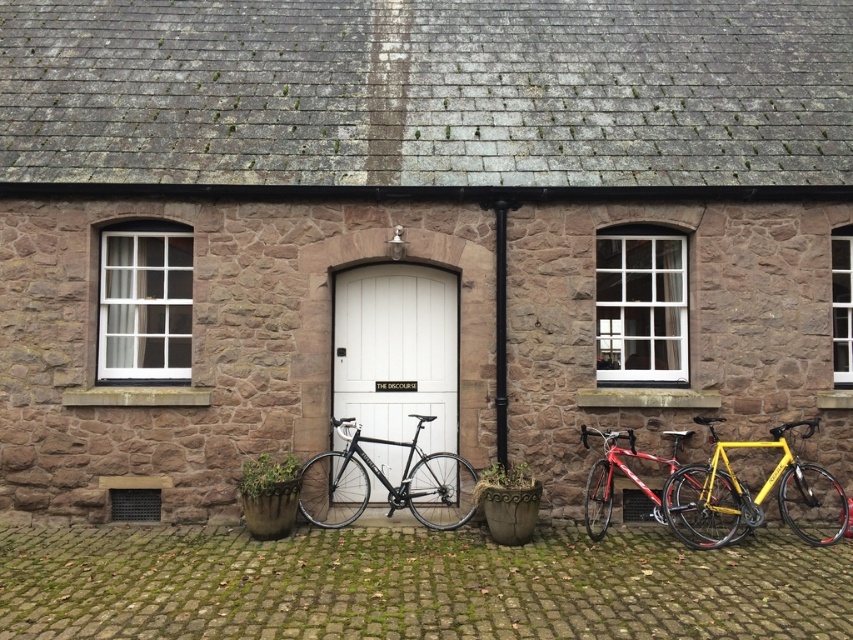
You are a visitor at the stone building and need to park your bicycles. The yellow matte bicycle at right and the shiny red bicycle at center are already parked. Which bicycle is taller?

The yellow matte bicycle at right is much taller than the shiny red bicycle at center.

You are a delivery person trying to deliver a package to the building. The shiny red bicycle at center is blocking the entrance. Can you pass through the white matte door at center without moving the bicycle?

The white matte door at center has a lesser width compared to shiny red bicycle at center, so the bicycle is wider than the door. Therefore, you cannot pass through the white matte door at center without moving the bicycle.

You are standing in front of the quaint stone building and want to enter through the white matte door at center. There is a 25 feet wide truck parked in front of the door. Can you walk around the truck to reach the door?

The distance between you and the white matte door at center is 30.41 feet. Since the truck is only 25 feet wide, there is enough space to walk around it and reach the door.